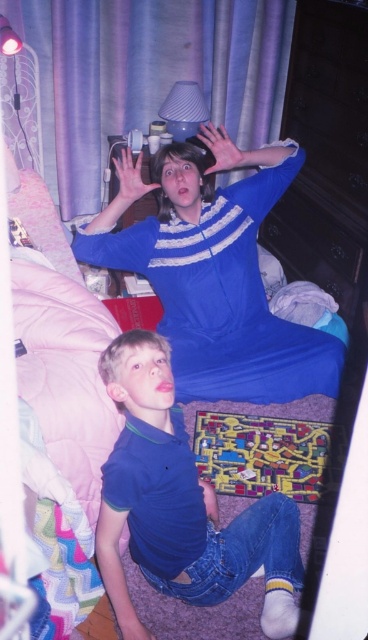
Question: Estimate the real-world distances between objects in this image. Which object is farther from the blue cotton shirt at lower left?

Choices:
 (A) matte plastic lampshade at upper center
 (B) purple fabric curtain at upper center
 (C) blue smooth dress at upper center

Answer: (B)

Question: Does purple fabric curtain at upper center appear on the left side of blue cotton shirt at lower left?

Choices:
 (A) yes
 (B) no

Answer: (A)

Question: Which of the following is the farthest from the observer?

Choices:
 (A) (167, 112)
 (B) (164, 300)
 (C) (119, 115)

Answer: (C)

Question: Among these points, which one is nearest to the camera?

Choices:
 (A) (210, 208)
 (B) (203, 99)

Answer: (A)

Question: Is blue smooth dress at upper center further to camera compared to matte plastic lampshade at upper center?

Choices:
 (A) no
 (B) yes

Answer: (A)

Question: Is purple fabric curtain at upper center positioned at the back of matte plastic lampshade at upper center?

Choices:
 (A) yes
 (B) no

Answer: (B)